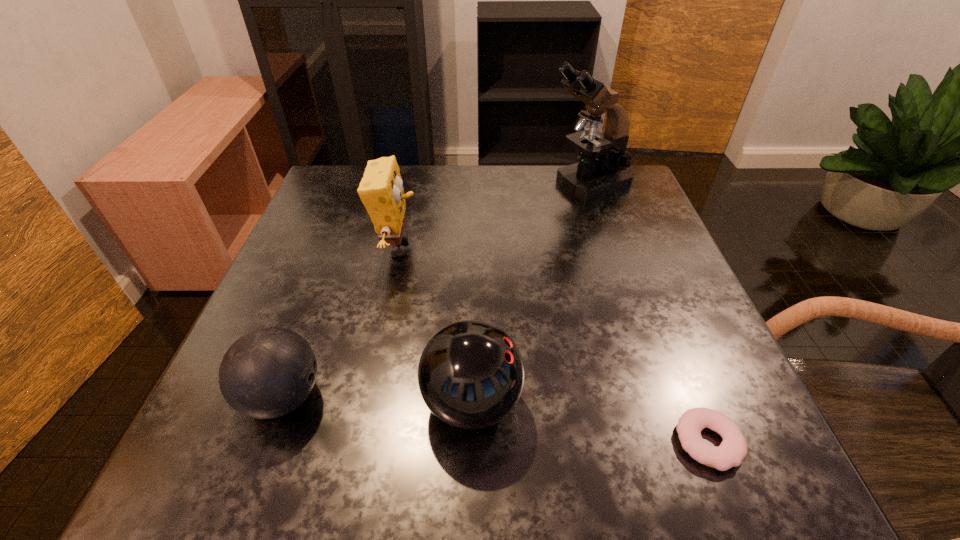
You are a GUI agent. You are given a task and a screenshot of the screen. Output one action in this format:
    pyautogui.click(x=<x>, y=<y>)
    Task: Click on the vacant space located on the surface of the right bowling ball near the finger holes
    
    Given the screenshot: What is the action you would take?
    pyautogui.click(x=587, y=403)

At what (x,y) coordinates should I click in order to perform the action: click on vacant region located 0.120m on the grip area of the shorter bowling ball. Please return your answer as a coordinate pair (x, y). Looking at the image, I should click on (402, 397).

Identify the location of free space located on the back of the shortest object. (656, 310).

At what (x,y) coordinates should I click in order to perform the action: click on object at the far edge. Please return your answer as a coordinate pair (x, y). The width and height of the screenshot is (960, 540). Looking at the image, I should click on (601, 170).

Identify the location of doughnut that is at the near edge. The height and width of the screenshot is (540, 960). (733, 449).

Image resolution: width=960 pixels, height=540 pixels. I want to click on object present at the left edge, so click(x=269, y=372).

Find the location of a particular element. The width and height of the screenshot is (960, 540). microscope at the right edge is located at coordinates (601, 170).

Find the location of a particular element. This screenshot has width=960, height=540. doughnut that is at the right edge is located at coordinates (733, 449).

This screenshot has height=540, width=960. Find the location of `object that is positioned at the near left corner`. object that is positioned at the near left corner is located at coordinates (269, 372).

Image resolution: width=960 pixels, height=540 pixels. Identify the location of object that is at the far right corner. (601, 170).